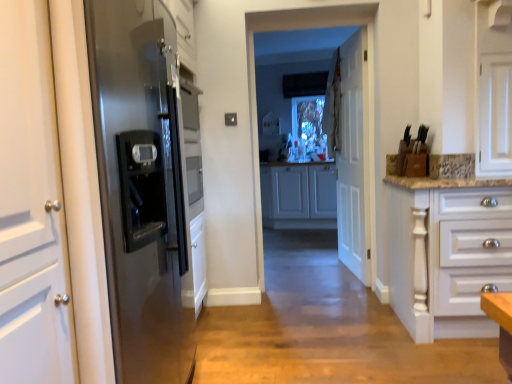
Locate an element on the screen. The width and height of the screenshot is (512, 384). vacant area that lies in front of clear glass window at center is located at coordinates (329, 303).